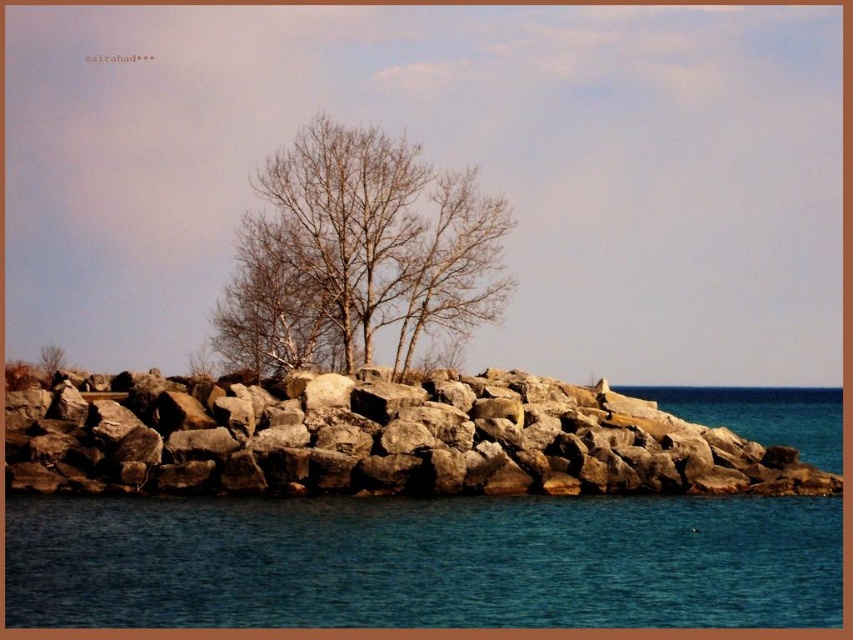
Who is lower down, blue water at lower center or brown rough rocks at center?

Positioned lower is blue water at lower center.

Does blue water at lower center lie in front of brown rough rocks at center?

Yes, it is.

Locate an element on the screen. blue water at lower center is located at coordinates (422, 563).

Image resolution: width=853 pixels, height=640 pixels. Identify the location of blue water at lower center. (422, 563).

Is brown rough rocks at center wider than bare branches at center?

Yes.

Is brown rough rocks at center positioned in front of bare branches at center?

Yes.

Is point (688, 452) farther from camera compared to point (229, 285)?

No, it is in front of (229, 285).

The width and height of the screenshot is (853, 640). Find the location of `brown rough rocks at center`. brown rough rocks at center is located at coordinates pos(379,440).

Is point (317, 596) positioned before point (334, 156)?

Yes, point (317, 596) is closer to viewer.

Who is taller, blue water at lower center or bare branches at center?

bare branches at center is taller.

Which is in front, point (700, 557) or point (248, 218)?

Point (700, 557) is more forward.

Image resolution: width=853 pixels, height=640 pixels. What are the coordinates of `blue water at lower center` in the screenshot? It's located at (422, 563).